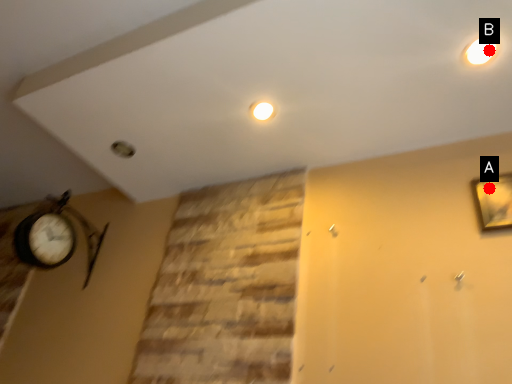
Question: Two points are circled on the image, labeled by A and B beside each circle. Among these points, which one is farthest from the camera?

Choices:
 (A) A is further
 (B) B is further

Answer: (A)